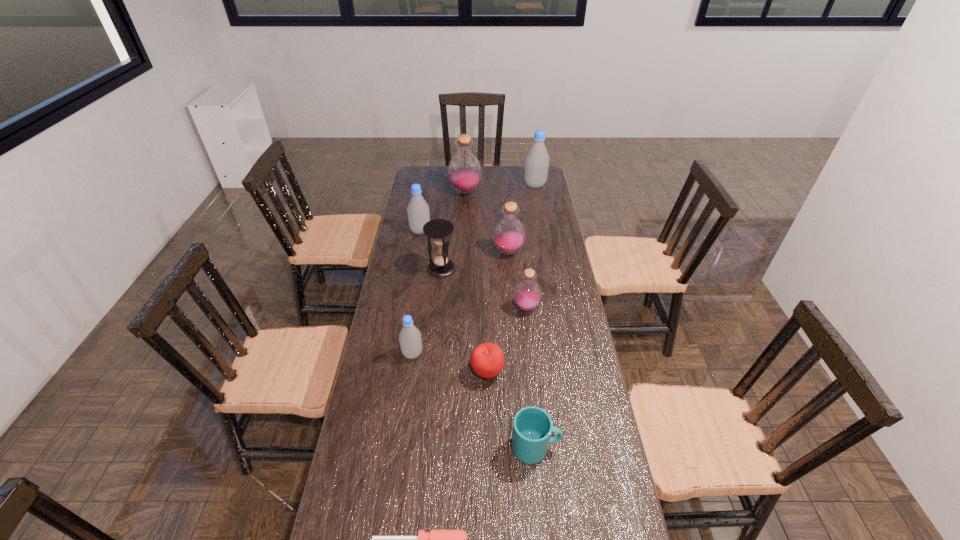
Image resolution: width=960 pixels, height=540 pixels. I want to click on the nearest bottle, so click(x=410, y=340).

Locate an element on the screen. the fifth nearest object is located at coordinates (527, 295).

You are a GUI agent. You are given a task and a screenshot of the screen. Output one action in this format:
    pyautogui.click(x=<x>, y=<y>)
    Task: Click on the second nearest bottle
    Image resolution: width=960 pixels, height=540 pixels.
    Given the screenshot: What is the action you would take?
    pyautogui.click(x=527, y=295)

Identify the location of cup. The width and height of the screenshot is (960, 540). (532, 427).

Find the location of `red apple`. red apple is located at coordinates (487, 360).

Where is `vacant space positioned 0.090m on the left of the biggest purple bottle`? vacant space positioned 0.090m on the left of the biggest purple bottle is located at coordinates (431, 192).

The height and width of the screenshot is (540, 960). I want to click on free space located 0.230m on the left of the farthest gray bottle, so click(480, 185).

I want to click on blank space located on the right of the second biggest purple bottle, so click(x=539, y=252).

You are a GUI agent. You are given a task and a screenshot of the screen. Output one action in this format:
    pyautogui.click(x=<x>, y=<y>)
    Task: Click on the vacant space located on the front of the second smallest gray bottle
    The height and width of the screenshot is (540, 960).
    Given the screenshot: What is the action you would take?
    [409, 300]

Where is `vacant region located on the right of the hourglass`? Image resolution: width=960 pixels, height=540 pixels. vacant region located on the right of the hourglass is located at coordinates (475, 268).